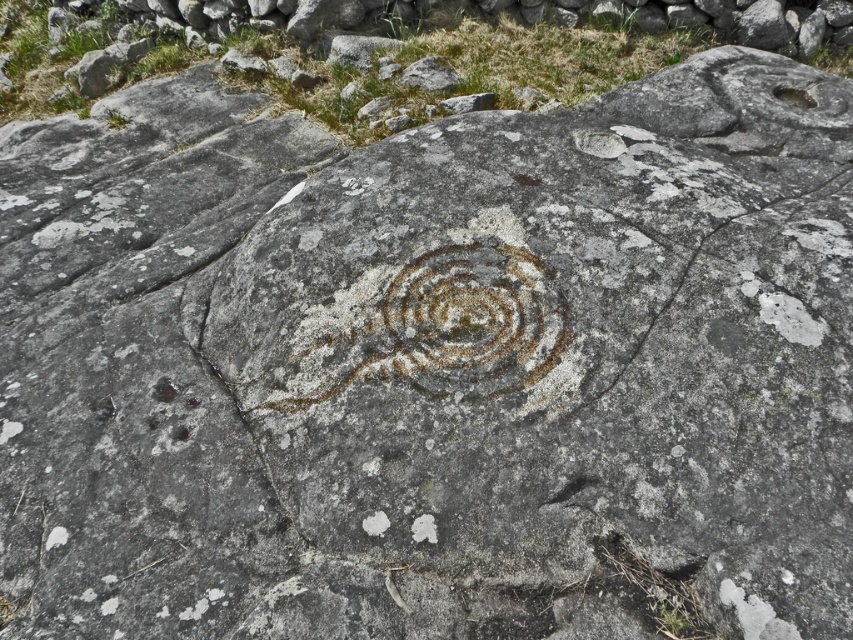
You are an archaeologist examining the rock surface. You notice two features at the center of the rock surface. Which one is larger in size between the gray rough crack at center and the rusty stone swirl at center?

The gray rough crack at center is bigger than the rusty stone swirl at center.

You are a geologist examining the gray rough crack at center. You notice another crack nearby. How far apart are they?

The gray rough crack at center and the other crack are 7.73 feet apart.